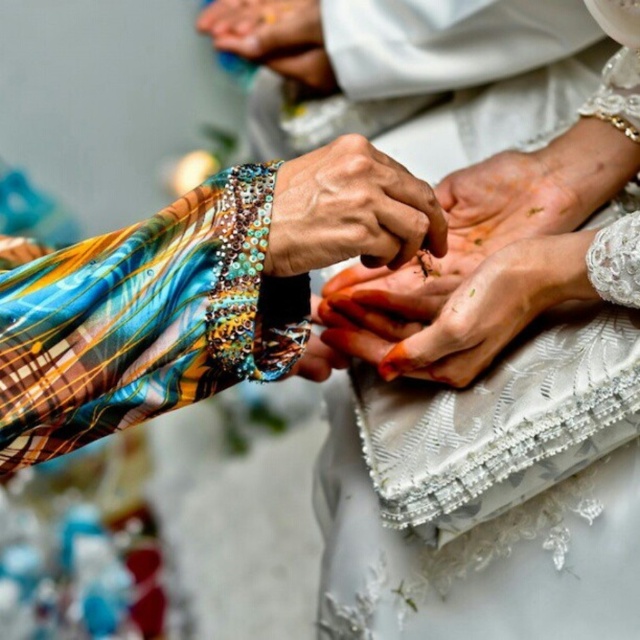
Can you confirm if white lace dress at center is positioned below multicolored fabric hand at center?

No.

Locate an element on the screen. white lace dress at center is located at coordinates (496, 403).

Where is `white lace dress at center`? white lace dress at center is located at coordinates (496, 403).

Can you confirm if white lace dress at center is positioned to the right of matte white hands at center?

Yes, white lace dress at center is to the right of matte white hands at center.

Does white lace dress at center have a smaller size compared to matte white hands at center?

Actually, white lace dress at center might be larger than matte white hands at center.

Image resolution: width=640 pixels, height=640 pixels. In order to click on white lace dress at center in this screenshot , I will do `click(496, 403)`.

Locate an element on the screen. white lace dress at center is located at coordinates (496, 403).

Measure the distance between point [355,198] and camera.

71.53 centimeters

Which is more to the left, multicolored beaded bracelet at center or dry skin at center?

Positioned to the left is multicolored beaded bracelet at center.

The image size is (640, 640). What do you see at coordinates (349, 211) in the screenshot?
I see `multicolored beaded bracelet at center` at bounding box center [349, 211].

Locate an element on the screen. multicolored beaded bracelet at center is located at coordinates (349, 211).